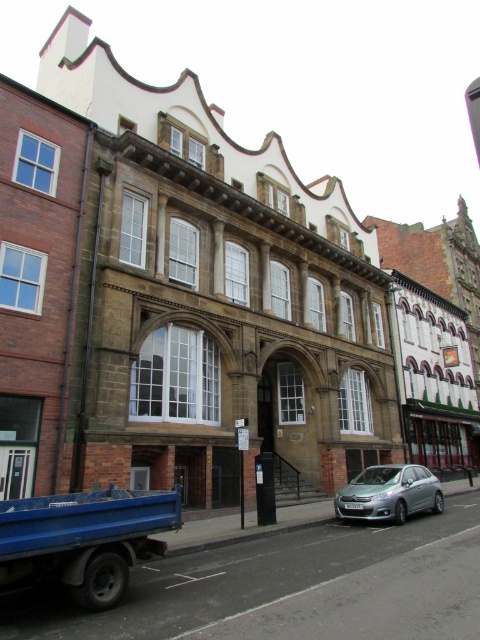
Question: Can you confirm if blue matte truck at lower left is bigger than satin silver car at lower center?

Choices:
 (A) yes
 (B) no

Answer: (B)

Question: Can you confirm if blue matte truck at lower left is positioned below satin silver car at lower center?

Choices:
 (A) no
 (B) yes

Answer: (A)

Question: Among these points, which one is nearest to the camera?

Choices:
 (A) (180, 508)
 (B) (336, 506)

Answer: (A)

Question: Considering the relative positions of blue matte truck at lower left and satin silver car at lower center in the image provided, where is blue matte truck at lower left located with respect to satin silver car at lower center?

Choices:
 (A) above
 (B) below

Answer: (A)

Question: Among these points, which one is farthest from the camera?

Choices:
 (A) (127, 570)
 (B) (429, 483)

Answer: (B)